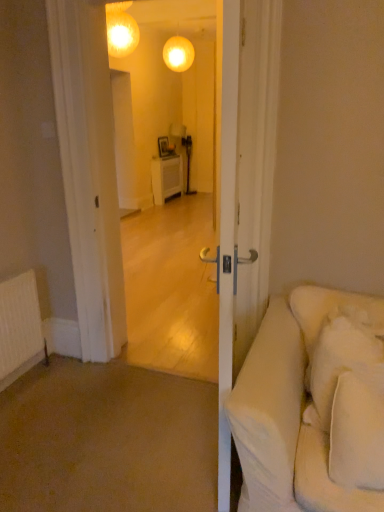
Question: From the image's perspective, relative to white soft pillow at right, arranged as the 2th pillow when viewed from the front, is white soft pillow at right, the second pillow when ordered from back to front, above or below?

Choices:
 (A) above
 (B) below

Answer: (B)

Question: In the image, is white soft pillow at right, the second pillow when ordered from back to front, on the left side or the right side of white soft pillow at right, arranged as the 2th pillow when viewed from the front?

Choices:
 (A) right
 (B) left

Answer: (B)

Question: Which object is the farthest from the white soft pillow at right, which is the 1th pillow from back to front?

Choices:
 (A) white soft pillow at right, which is the first pillow from front to back
 (B) matte glass globe at upper center

Answer: (B)

Question: Estimate the real-world distances between objects in this image. Which object is farther from the white soft pillow at right, the second pillow when ordered from back to front?

Choices:
 (A) matte glass globe at upper center
 (B) white soft pillow at right, arranged as the 2th pillow when viewed from the front

Answer: (A)